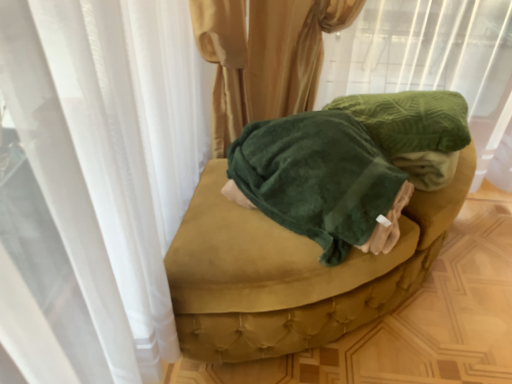
Question: From the image's perspective, is green velvety fabric at upper center positioned above or below velvety green blanket at center?

Choices:
 (A) below
 (B) above

Answer: (B)

Question: Is green velvety fabric at upper center inside the boundaries of velvety green blanket at center, or outside?

Choices:
 (A) inside
 (B) outside

Answer: (B)

Question: Estimate the real-world distances between objects in this image. Which object is closer to the velvety green blanket at center?

Choices:
 (A) green velvety fabric at upper center
 (B) velvet green ottoman at center

Answer: (B)

Question: Based on their relative distances, which object is farther from the velvety green blanket at center?

Choices:
 (A) velvet green ottoman at center
 (B) green velvety fabric at upper center

Answer: (B)